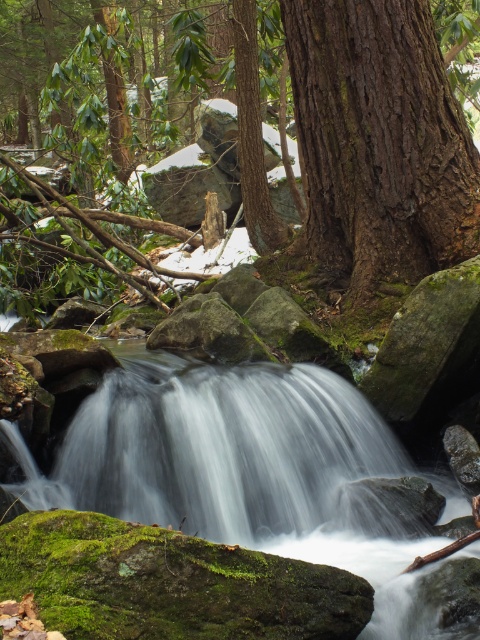
Question: In this image, where is brown rough tree at center located relative to white smooth water at center?

Choices:
 (A) above
 (B) below

Answer: (A)

Question: Which point is closer to the camera?

Choices:
 (A) (352, 552)
 (B) (372, 76)
 (C) (132, 51)

Answer: (A)

Question: Which is nearer to the white smooth water at center?

Choices:
 (A) dark brown textured bark at center
 (B) brown rough tree at center

Answer: (A)

Question: Does brown rough tree at center have a smaller size compared to white smooth water at center?

Choices:
 (A) yes
 (B) no

Answer: (B)

Question: Which object is the farthest from the white smooth water at center?

Choices:
 (A) dark brown textured bark at center
 (B) brown rough tree at center

Answer: (B)

Question: Is brown rough tree at center above white smooth water at center?

Choices:
 (A) no
 (B) yes

Answer: (B)